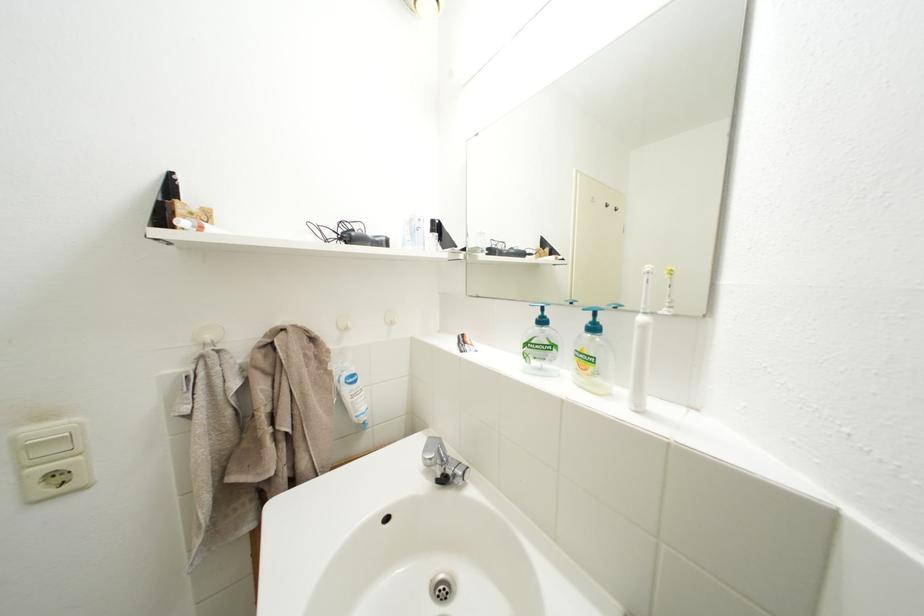
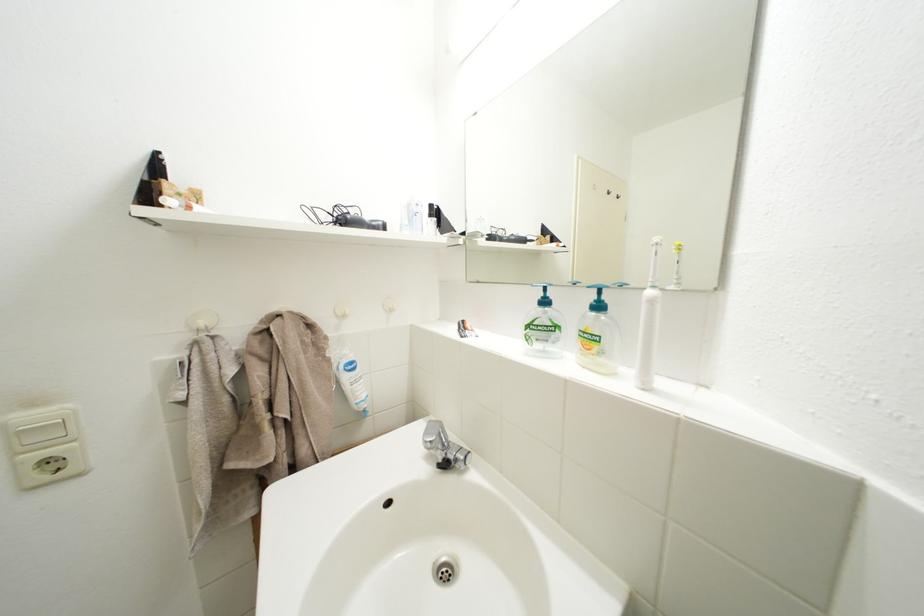
In the second image, find the point that corresponds to (386,244) in the first image.

(383, 228)